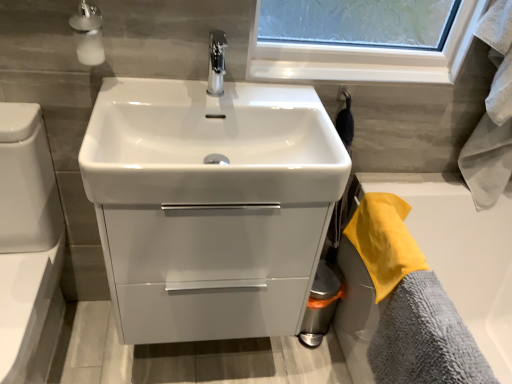
You are a GUI agent. You are given a task and a screenshot of the screen. Output one action in this format:
    pyautogui.click(x=<x>, y=<y>)
    Task: Click on the vacant space in white glossy sink at center (from a real-world perspective)
    
    Given the screenshot: What is the action you would take?
    pyautogui.click(x=203, y=356)